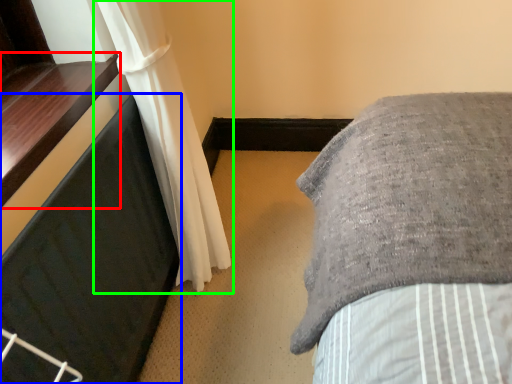
Question: Which object is the closest to the window sill (highlighted by a red box)? Choose among these: furniture (highlighted by a blue box) or curtain (highlighted by a green box).

Choices:
 (A) furniture
 (B) curtain

Answer: (A)